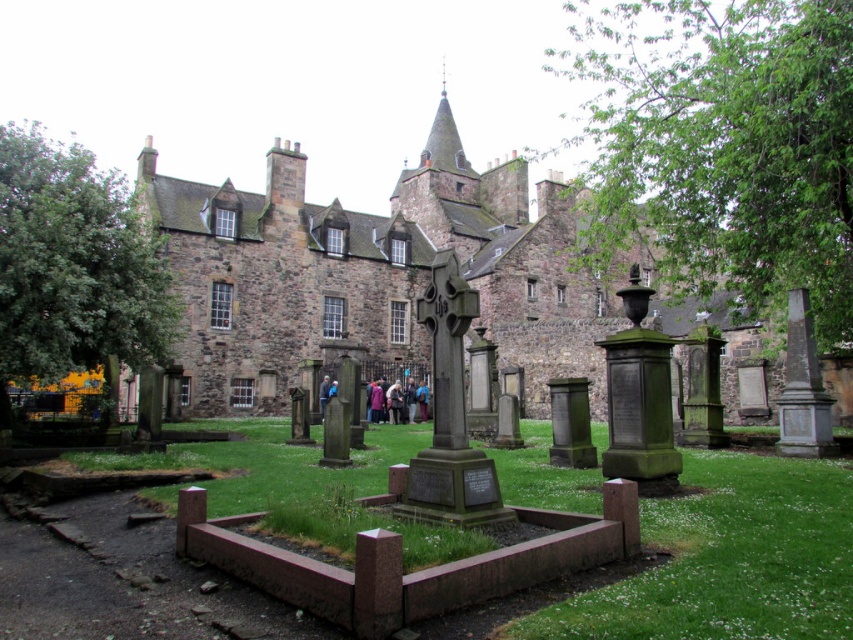
You are standing in the historic cemetery and want to take a photo of the brown stone castle at center. Which direction should you face to ensure the castle is in the frame?

Since the brown stone castle at center is located at point (373,273), you should face towards the center of the image to capture it in your photo.

You are standing at the entrance of the historic cemetery in front of the stone building. You see a dark purple sweater at center and a dark blue fabric at center. Which one is closer to you?

The dark purple sweater at center is 7.50 meters away from the dark blue fabric at center, so the dark blue fabric at center is closer to you.